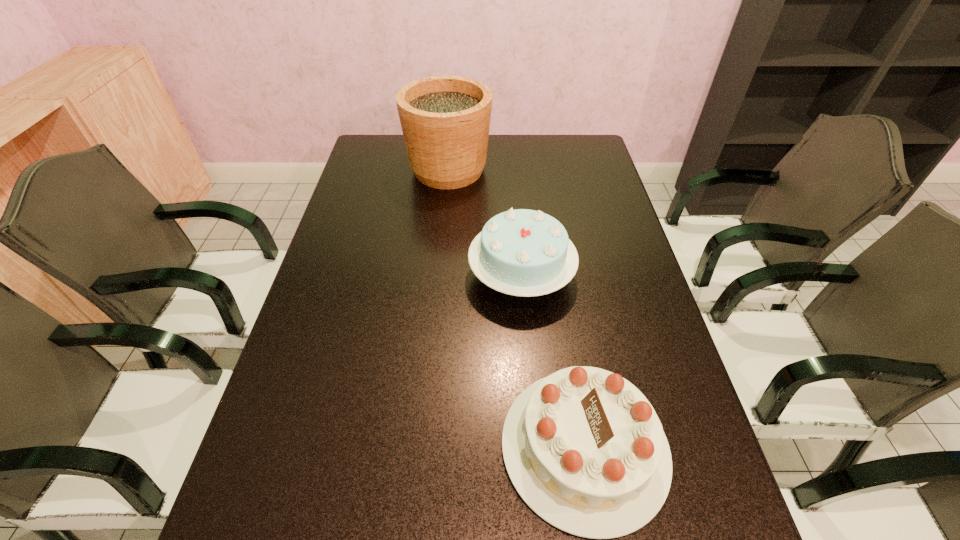
I want to click on flowerpot, so click(x=445, y=120).

I want to click on the farthest object, so click(x=445, y=120).

At what (x,y) coordinates should I click in order to perform the action: click on the farther birthday cake. Please return your answer as a coordinate pair (x, y). The height and width of the screenshot is (540, 960). Looking at the image, I should click on (521, 252).

The width and height of the screenshot is (960, 540). Identify the location of the second tallest object. (521, 252).

In order to click on vacant space located 0.100m on the back of the flowerpot in this screenshot , I will do `click(451, 135)`.

Locate an element on the screen. The image size is (960, 540). free space located on the right of the second farthest object is located at coordinates (630, 275).

Where is `object positioned at the far edge`? object positioned at the far edge is located at coordinates (445, 120).

This screenshot has width=960, height=540. Identify the location of vacant space at the far edge of the desktop. (531, 168).

This screenshot has height=540, width=960. In the image, there is a desktop. Identify the location of free region at the left edge. (391, 177).

In the image, there is a desktop. In order to click on free space at the right edge in this screenshot , I will do `click(609, 216)`.